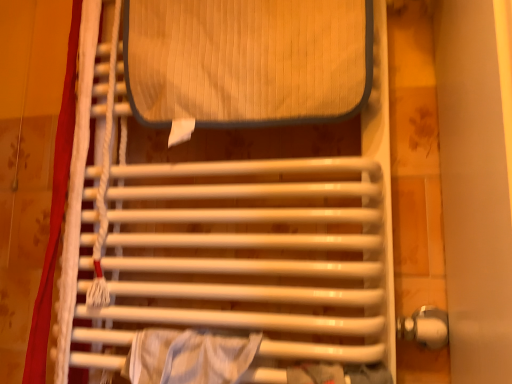
Locate an element on the screen. white fabric curtain at left is located at coordinates (54, 213).

Measure the distance between white fabric curtain at left and camera.

white fabric curtain at left is 61.73 centimeters away from camera.

Based on the photo, measure the distance between point [69,119] and camera.

The distance of point [69,119] from camera is 26.69 inches.

What is the approximate width of white fabric curtain at left?

white fabric curtain at left is 3.16 inches in width.

The height and width of the screenshot is (384, 512). What do you see at coordinates (54, 213) in the screenshot?
I see `white fabric curtain at left` at bounding box center [54, 213].

Locate an element on the screen. white glossy towel rack at center is located at coordinates (234, 244).

The width and height of the screenshot is (512, 384). What do you see at coordinates (234, 244) in the screenshot?
I see `white glossy towel rack at center` at bounding box center [234, 244].

This screenshot has height=384, width=512. I want to click on white fabric curtain at left, so click(x=54, y=213).

Visually, is white glossy towel rack at center positioned to the left or to the right of white fabric curtain at left?

white glossy towel rack at center is positioned on white fabric curtain at left's right side.

Considering their positions, is white glossy towel rack at center located in front of or behind white fabric curtain at left?

In the image, white glossy towel rack at center appears in front of white fabric curtain at left.

Which point is more forward, (230, 320) or (47, 246)?

The point (230, 320) is closer to the camera.

From the image's perspective, which is below, white glossy towel rack at center or white fabric curtain at left?

From the image's view, white fabric curtain at left is below.

From a real-world perspective, does white glossy towel rack at center sit lower than white fabric curtain at left?

No, from a real-world perspective, white glossy towel rack at center is not beneath white fabric curtain at left.

Considering the sizes of objects white glossy towel rack at center and white fabric curtain at left in the image provided, who is wider, white glossy towel rack at center or white fabric curtain at left?

With larger width is white glossy towel rack at center.

Between white glossy towel rack at center and white fabric curtain at left, which one has less height?

With less height is white glossy towel rack at center.

Does white glossy towel rack at center have a smaller size compared to white fabric curtain at left?

No.

Choose the correct answer: Is white glossy towel rack at center inside white fabric curtain at left or outside it?

white glossy towel rack at center is spatially situated outside white fabric curtain at left.

Is white glossy towel rack at center in contact with white fabric curtain at left?

There is a gap between white glossy towel rack at center and white fabric curtain at left.

Could you tell me if white glossy towel rack at center is facing white fabric curtain at left?

No, white glossy towel rack at center is not oriented towards white fabric curtain at left.

How different are the orientations of white glossy towel rack at center and white fabric curtain at left in degrees?

The facing directions of white glossy towel rack at center and white fabric curtain at left are 0.00158 degrees apart.

I want to click on furniture on the right of the white fabric curtain at left, so click(234, 244).

Which object is positioned more to the left, white fabric curtain at left or white glossy towel rack at center?

white fabric curtain at left is more to the left.

Looking at this image, is the position of white fabric curtain at left less distant than that of white glossy towel rack at center?

No.

Considering the points (66, 104) and (87, 49), which point is in front, point (66, 104) or point (87, 49)?

The point (87, 49) is in front.

From the image's perspective, is white fabric curtain at left positioned above or below white glossy towel rack at center?

From the image's perspective, white fabric curtain at left appears below white glossy towel rack at center.

From a real-world perspective, which object stands above the other?

white glossy towel rack at center is physically above.

Considering the sizes of objects white fabric curtain at left and white glossy towel rack at center in the image provided, who is thinner, white fabric curtain at left or white glossy towel rack at center?

white fabric curtain at left is thinner.

Between white fabric curtain at left and white glossy towel rack at center, which one has less height?

white glossy towel rack at center.

Who is smaller, white fabric curtain at left or white glossy towel rack at center?

With smaller size is white fabric curtain at left.

From the picture: Is white fabric curtain at left inside the boundaries of white glossy towel rack at center, or outside?

The correct answer is: inside.

Is there a large distance between white fabric curtain at left and white glossy towel rack at center?

No, white fabric curtain at left is not far from white glossy towel rack at center.

Is white fabric curtain at left facing away from white glossy towel rack at center?

Yes, white fabric curtain at left's orientation is away from white glossy towel rack at center.

Locate an element on the screen. The width and height of the screenshot is (512, 384). furniture on the right side of white fabric curtain at left is located at coordinates (234, 244).

Locate an element on the screen. Image resolution: width=512 pixels, height=384 pixels. curtain located behind the white glossy towel rack at center is located at coordinates (54, 213).

What are the coordinates of `furniture on the right of white fabric curtain at left` in the screenshot? It's located at (234, 244).